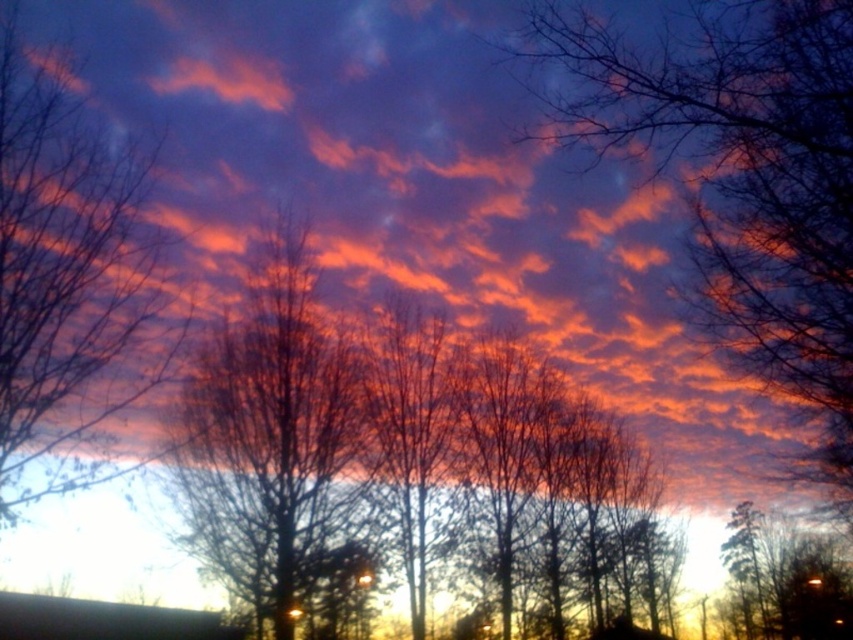
Is silhouette bare branches at upper center smaller than bare branches at center?

Yes, silhouette bare branches at upper center is smaller than bare branches at center.

From the picture: Between silhouette bare branches at upper center and bare branches at center, which one is positioned higher?

silhouette bare branches at upper center is above.

Find the location of `silhouette bare branches at upper center`. silhouette bare branches at upper center is located at coordinates (741, 179).

The width and height of the screenshot is (853, 640). Identify the location of silhouette bare branches at upper center. (741, 179).

Who is taller, silhouette bare branches at upper center or bare branches at left?

Standing taller between the two is bare branches at left.

Is silhouette bare branches at upper center above bare branches at left?

Yes.

Which is in front, point (793, 170) or point (1, 468)?

Point (1, 468) is more forward.

You are a GUI agent. You are given a task and a screenshot of the screen. Output one action in this format:
    pyautogui.click(x=<x>, y=<y>)
    Task: Click on the silhouette bare branches at upper center
    This screenshot has height=640, width=853.
    Given the screenshot: What is the action you would take?
    pyautogui.click(x=741, y=179)

Does bare branches at left have a lesser height compared to bare branches at center?

Yes, bare branches at left is shorter than bare branches at center.

Which is below, bare branches at left or bare branches at center?

bare branches at center is lower down.

Is point (117, 154) more distant than point (196, 516)?

No, (117, 154) is in front of (196, 516).

Locate an element on the screen. This screenshot has height=640, width=853. bare branches at left is located at coordinates (70, 278).